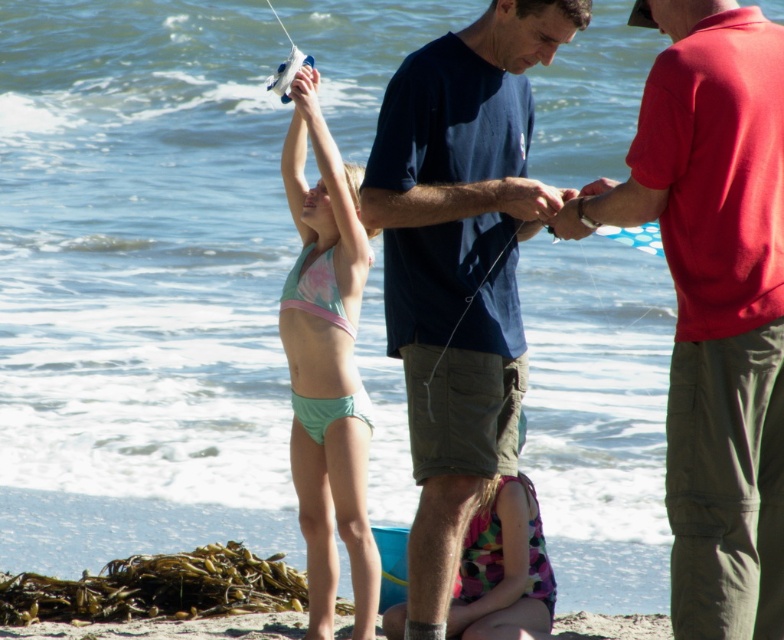
Question: Can you confirm if dark blue t-shirt at center is smaller than teal fabric bikini at center?

Choices:
 (A) yes
 (B) no

Answer: (B)

Question: Which point is closer to the camera taking this photo?

Choices:
 (A) (376, 136)
 (B) (325, 227)
 (C) (528, 579)

Answer: (A)

Question: Is red cotton shirt at right smaller than teal fabric bikini at center?

Choices:
 (A) yes
 (B) no

Answer: (B)

Question: Which point is closer to the camera?

Choices:
 (A) (398, 604)
 (B) (434, 339)
 (C) (298, 76)

Answer: (B)

Question: Is red cotton shirt at right above teal fabric bikini at center?

Choices:
 (A) yes
 (B) no

Answer: (A)

Question: Considering the real-world distances, which object is farthest from the red cotton shirt at right?

Choices:
 (A) teal fabric bikini at center
 (B) dark blue t-shirt at center
 (C) multicolored polka dot swimsuit at center

Answer: (A)